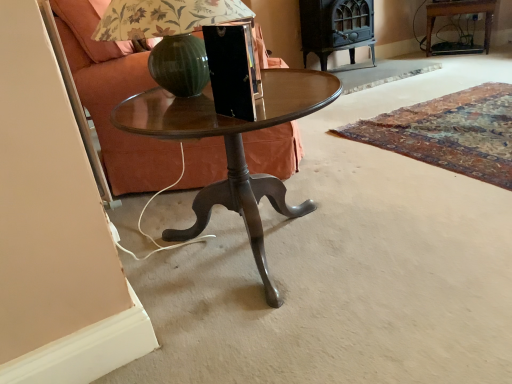
Question: Considering the positions of metallic green glass at center and matte brown fabric armchair at left in the image, is metallic green glass at center bigger or smaller than matte brown fabric armchair at left?

Choices:
 (A) big
 (B) small

Answer: (B)

Question: Considering the positions of metallic green glass at center and matte brown fabric armchair at left in the image, is metallic green glass at center taller or shorter than matte brown fabric armchair at left?

Choices:
 (A) short
 (B) tall

Answer: (A)

Question: Estimate the real-world distances between objects in this image. Which object is closer to the matte brown fabric armchair at left?

Choices:
 (A) wooden side table at upper right
 (B) metallic green glass at center
 (C) wooden glossy table at center

Answer: (B)

Question: Considering the real-world distances, which object is closest to the metallic green glass at center?

Choices:
 (A) wooden side table at upper right
 (B) wooden glossy table at center
 (C) matte brown fabric armchair at left

Answer: (B)